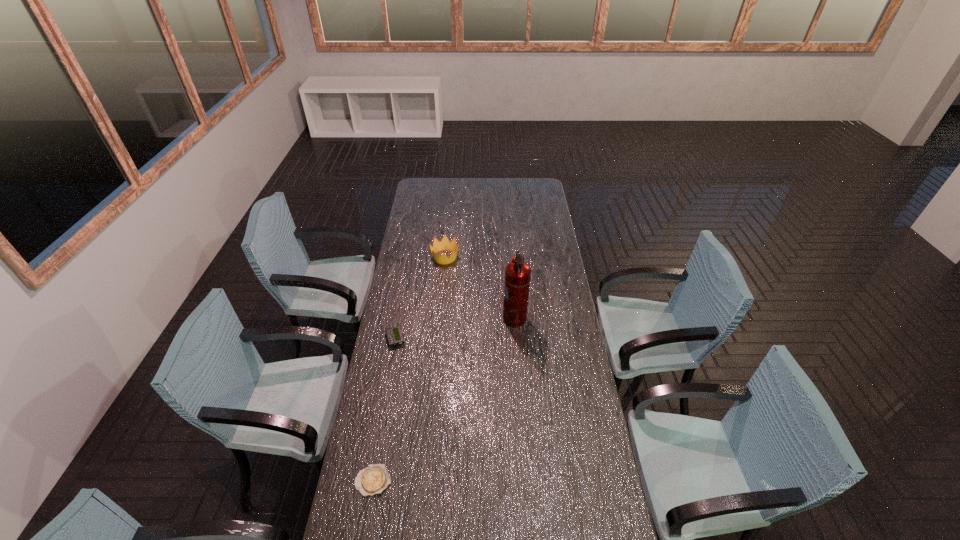
At what (x,y) coordinates should I click in order to perform the action: click on empty space that is in between the beeper and the nearest object. Please return your answer as a coordinate pair (x, y). This screenshot has width=960, height=540. Looking at the image, I should click on (384, 410).

Find the location of `free space that is in between the tallest object and the second tallest object`. free space that is in between the tallest object and the second tallest object is located at coordinates (480, 288).

Locate an element on the screen. vacant region between the rightmost object and the beeper is located at coordinates (455, 329).

Identify the location of vacant region between the third tallest object and the fire extinguisher. The height and width of the screenshot is (540, 960). (455, 329).

The image size is (960, 540). Identify the location of free spot between the shortest object and the fire extinguisher. (444, 400).

Locate an element on the screen. This screenshot has width=960, height=540. unoccupied position between the nearest object and the tallest object is located at coordinates (444, 400).

You are a GUI agent. You are given a task and a screenshot of the screen. Output one action in this format:
    pyautogui.click(x=<x>, y=<y>)
    Task: Click on the free space between the tallest object and the shortest object
    The height and width of the screenshot is (540, 960).
    Given the screenshot: What is the action you would take?
    pyautogui.click(x=444, y=400)

You are a GUI agent. You are given a task and a screenshot of the screen. Output one action in this format:
    pyautogui.click(x=<x>, y=<y>)
    Task: Click on the vacant point located between the quiche and the tallest object
    The width and height of the screenshot is (960, 540).
    Given the screenshot: What is the action you would take?
    point(444,400)

Identify which object is the second closest to the tallest object. Please provide its 2D coordinates. Your answer should be formatted as a tuple, i.e. [(x, y)], where the tuple contains the x and y coordinates of a point satisfying the conditions above.

[(394, 335)]

Identify which object is the closest to the crown. Please provide its 2D coordinates. Your answer should be formatted as a tuple, i.e. [(x, y)], where the tuple contains the x and y coordinates of a point satisfying the conditions above.

[(517, 277)]